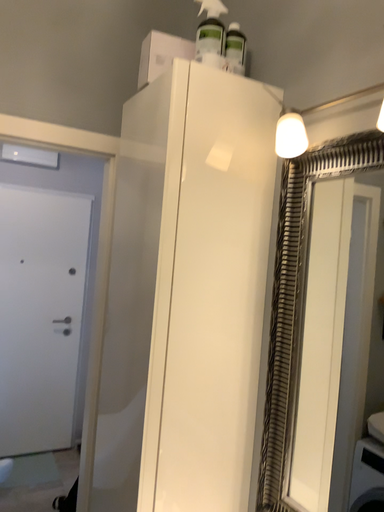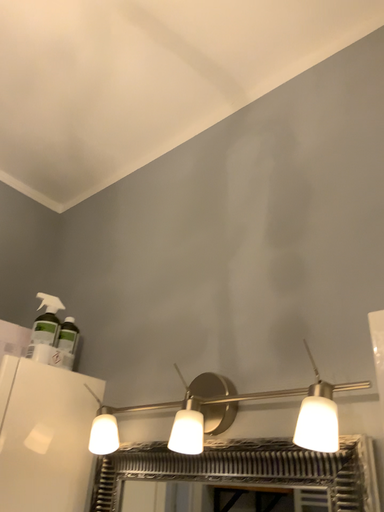
Question: Which way did the camera rotate in the video?

Choices:
 (A) rotated upward
 (B) rotated downward

Answer: (A)